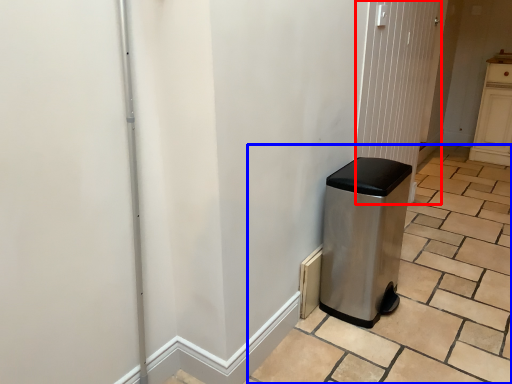
Question: Among these objects, which one is farthest to the camera, screen door (highlighted by a red box) or tile (highlighted by a blue box)?

Choices:
 (A) screen door
 (B) tile

Answer: (A)